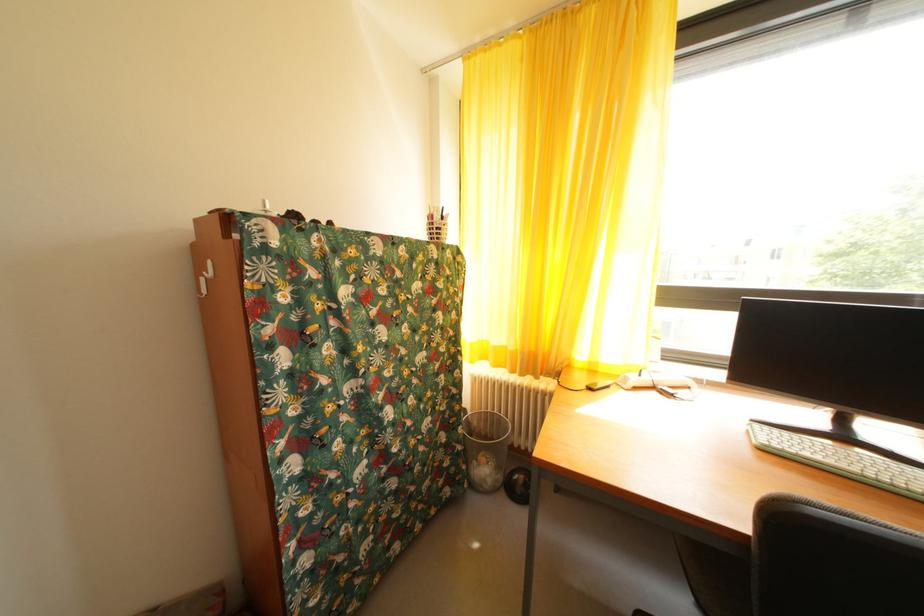
Find the location of a particular element. The image size is (924, 616). wire mesh trash can is located at coordinates (485, 448).